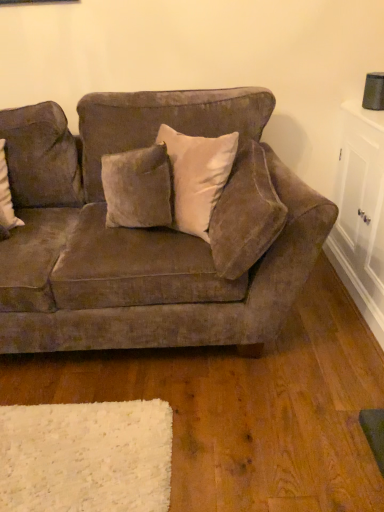
The width and height of the screenshot is (384, 512). What are the coordinates of `velvet brown couch at center` in the screenshot? It's located at (138, 234).

The image size is (384, 512). Describe the element at coordinates (245, 214) in the screenshot. I see `velvet beige pillow at upper center` at that location.

Consider the image. In order to face velvet beige pillow at upper center, should I rotate leftwards or rightwards?

Turn right by 6.205 degrees to look at velvet beige pillow at upper center.

Identify the location of velvet brown couch at center. (138, 234).

Can you see velvet beige pillow at upper center touching velvet brown couch at center?

No, velvet beige pillow at upper center is not touching velvet brown couch at center.

Considering the relative positions of velvet beige pillow at upper center and velvet brown couch at center in the image provided, is velvet beige pillow at upper center to the left of velvet brown couch at center from the viewer's perspective?

In fact, velvet beige pillow at upper center is to the right of velvet brown couch at center.

How many degrees apart are the facing directions of velvet beige pillow at upper center and velvet brown couch at center?

They differ by 87 degrees in their facing directions.

Is velvet beige pillow at upper center facing towards white glossy cabinet at right?

No, velvet beige pillow at upper center is not turned towards white glossy cabinet at right.

Do you think velvet beige pillow at upper center is within white glossy cabinet at right, or outside of it?

velvet beige pillow at upper center is not inside white glossy cabinet at right, it's outside.

Are velvet beige pillow at upper center and white glossy cabinet at right located far from each other?

velvet beige pillow at upper center is near white glossy cabinet at right, not far away.

Can you confirm if velvet beige pillow at upper center is shorter than white glossy cabinet at right?

Indeed, velvet beige pillow at upper center has a lesser height compared to white glossy cabinet at right.

Is velvet brown couch at center oriented towards white glossy cabinet at right?

No, velvet brown couch at center does not turn towards white glossy cabinet at right.

Which of these two, velvet brown couch at center or white glossy cabinet at right, stands shorter?

With less height is white glossy cabinet at right.

Find the location of a particular element. studio couch below the white glossy cabinet at right (from the image's perspective) is located at coordinates (138, 234).

Between velvet brown couch at center and white glossy cabinet at right, which one appears on the right side from the viewer's perspective?

white glossy cabinet at right.

Does velvet brown couch at center appear on the right side of velvet beige pillow at upper center?

Incorrect, velvet brown couch at center is not on the right side of velvet beige pillow at upper center.

Between velvet brown couch at center and velvet beige pillow at upper center, which one has more height?

velvet brown couch at center is taller.

From the image's perspective, is velvet brown couch at center below velvet beige pillow at upper center?

Indeed, from the image's perspective, velvet brown couch at center is shown beneath velvet beige pillow at upper center.

Is white glossy cabinet at right next to velvet brown couch at center and touching it?

No, white glossy cabinet at right is not in contact with velvet brown couch at center.

From the image's perspective, is white glossy cabinet at right under velvet brown couch at center?

No, from the image's perspective, white glossy cabinet at right is not below velvet brown couch at center.

Based on their positions, is white glossy cabinet at right located to the left or right of velvet brown couch at center?

Based on their positions, white glossy cabinet at right is located to the right of velvet brown couch at center.

Is velvet brown couch at center surrounded by white glossy cabinet at right?

No, velvet brown couch at center is not surrounded by white glossy cabinet at right.

Is white glossy cabinet at right in contact with velvet beige pillow at upper center?

They are not placed beside each other.

Can you confirm if white glossy cabinet at right is positioned to the left of velvet beige pillow at upper center?

No.

Is white glossy cabinet at right oriented away from velvet beige pillow at upper center?

white glossy cabinet at right is not turned away from velvet beige pillow at upper center.

Who is bigger, white glossy cabinet at right or velvet beige pillow at upper center?

white glossy cabinet at right is bigger.

This screenshot has width=384, height=512. Identify the location of studio couch on the left of velvet beige pillow at upper center. 138,234.

Find the location of a particular element. The height and width of the screenshot is (512, 384). table lying behind the velvet beige pillow at upper center is located at coordinates (361, 212).

Which object lies nearer to the anchor point velvet brown couch at center, white glossy cabinet at right or velvet beige pillow at upper center?

velvet beige pillow at upper center is closer to velvet brown couch at center.

Which object lies nearer to the anchor point velvet brown couch at center, velvet beige pillow at upper center or white glossy cabinet at right?

velvet beige pillow at upper center lies closer to velvet brown couch at center than the other object.

Which object lies further to the anchor point white glossy cabinet at right, velvet beige pillow at upper center or velvet brown couch at center?

The object further to white glossy cabinet at right is velvet brown couch at center.

Based on their spatial positions, is velvet brown couch at center or velvet beige pillow at upper center further from white glossy cabinet at right?

Based on the image, velvet brown couch at center appears to be further to white glossy cabinet at right.

Considering their positions, is velvet brown couch at center positioned closer to velvet beige pillow at upper center than white glossy cabinet at right?

velvet brown couch at center lies closer to velvet beige pillow at upper center than the other object.

Consider the image. From the image, which object appears to be nearer to velvet beige pillow at upper center, white glossy cabinet at right or velvet brown couch at center?

velvet brown couch at center.

Find the location of `pillow situated between velvet brown couch at center and white glossy cabinet at right from left to right`. pillow situated between velvet brown couch at center and white glossy cabinet at right from left to right is located at coordinates (245, 214).